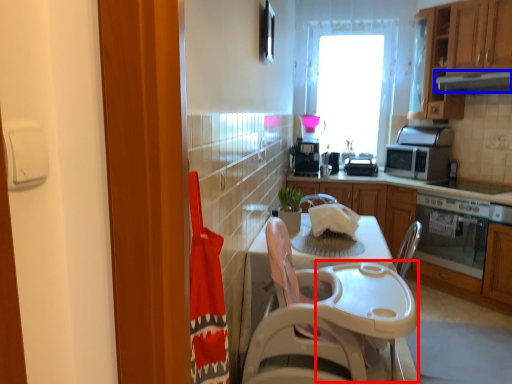
Question: Among these objects, which one is farthest to the camera, table (highlighted by a red box) or exhaust hood (highlighted by a blue box)?

Choices:
 (A) table
 (B) exhaust hood

Answer: (B)